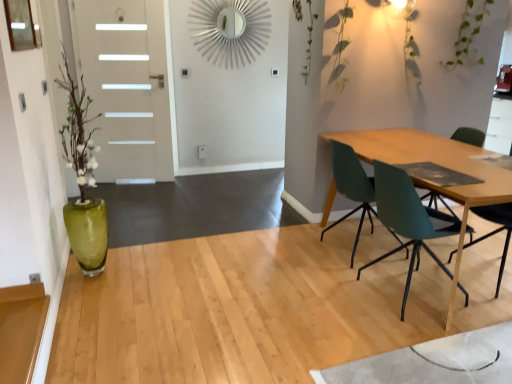
Question: Considering the positions of teal plastic chair at right, which is the 1th chair in front-to-back order, and white glossy door at left in the image, is teal plastic chair at right, which is the 1th chair in front-to-back order, taller or shorter than white glossy door at left?

Choices:
 (A) short
 (B) tall

Answer: (A)

Question: From the image's perspective, is teal plastic chair at right, which is the 1th chair in front-to-back order, above or below white glossy door at left?

Choices:
 (A) above
 (B) below

Answer: (B)

Question: Estimate the real-world distances between objects in this image. Which object is closer to the white glossy door at left?

Choices:
 (A) teal matte chair at right, the second chair positioned from the front
 (B) teal plastic chair at right, which is the 1th chair in front-to-back order

Answer: (A)

Question: Which is nearer to the teal plastic chair at right, the 2th chair in the back-to-front sequence?

Choices:
 (A) white glossy door at left
 (B) teal matte chair at right, which is the first chair from back to front

Answer: (B)